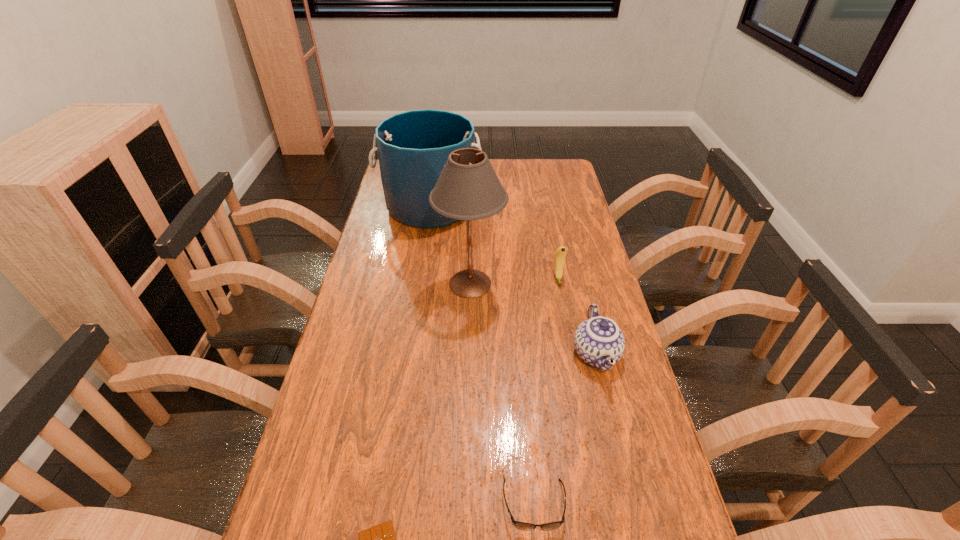
Find the location of `object that is positioned at the far edge`. object that is positioned at the far edge is located at coordinates (413, 147).

I want to click on object located at the left edge, so click(x=413, y=147).

Identify the location of banana present at the right edge. This screenshot has height=540, width=960. (560, 253).

The image size is (960, 540). What are the coordinates of `chinaware that is at the right edge` in the screenshot? It's located at (599, 341).

Locate an element on the screen. The height and width of the screenshot is (540, 960). object positioned at the far left corner is located at coordinates (413, 147).

Where is `vacant space at the far edge`? The width and height of the screenshot is (960, 540). vacant space at the far edge is located at coordinates (493, 163).

Locate an element on the screen. free space at the left edge of the desktop is located at coordinates (371, 434).

You are a GUI agent. You are given a task and a screenshot of the screen. Output one action in this format:
    pyautogui.click(x=<x>, y=<y>)
    Task: Click on the blank space at the right edge of the desktop
    The height and width of the screenshot is (540, 960).
    Given the screenshot: What is the action you would take?
    pyautogui.click(x=626, y=377)

Where is `blank space at the far right corner of the desktop`? This screenshot has height=540, width=960. blank space at the far right corner of the desktop is located at coordinates (545, 164).

Locate an element on the screen. vacant area that lies between the banana and the third nearest object is located at coordinates (577, 316).